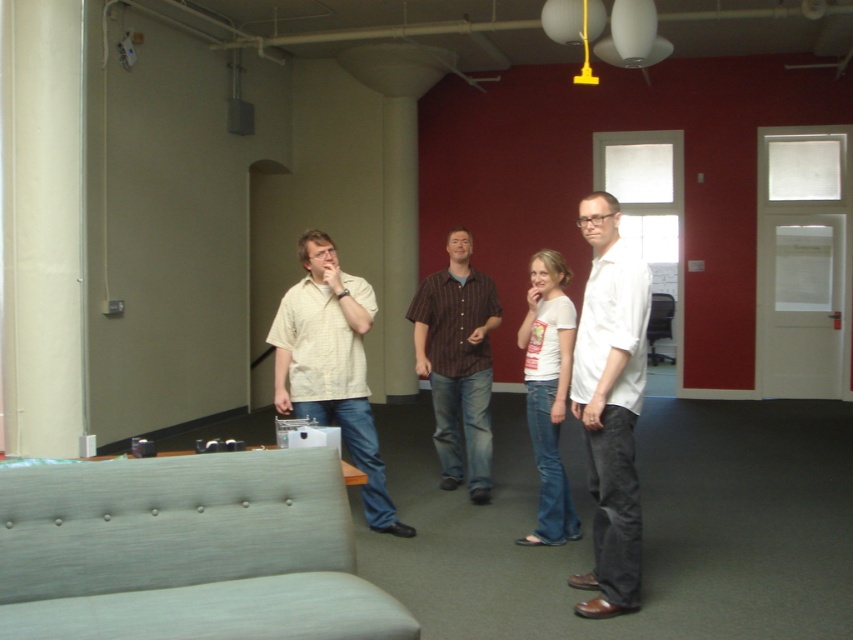
You are standing in the office and want to hand a document to the person wearing the white matte shirt at center and the matte beige shirt at center. Which one can you reach first without moving?

The white matte shirt at center is closer to the viewer, so you can reach them first without moving.

You are standing in the office and want to find the white matte shirt at center. According to the coordinates provided, where should you look to locate it?

The white matte shirt at center is located at point [610,404].